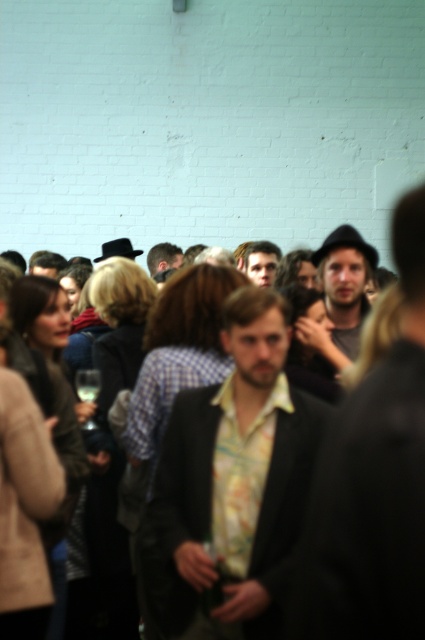
You are at a social event and want to find someone wearing a shiny brown hair at center. Which object is located above the matte yellow shirt at center?

The shiny brown hair at center is located above the matte yellow shirt at center.

You are standing in the middle of the room and want to find the floral print shirt at center. Based on the coordinates provided, in which direction should you move to locate it?

The floral print shirt at center is located at coordinates 0.744 on the x axis and 0.560 on the y axis. Since you are at the center of the room, which would be coordinates 0.5 on both axes, you should move to the right and slightly forward to reach the floral print shirt at center.